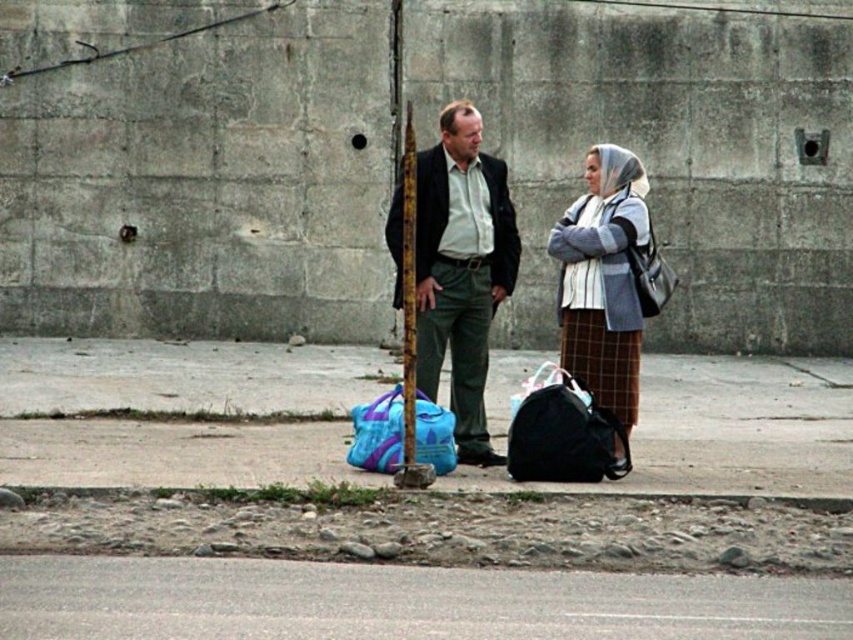
You are a photographer setting up a tripod to take a photo of the dark green fabric jacket at center and the matte blue duffel bag at center. Since you want to capture both items clearly in the frame, which object should you focus on first to ensure proper depth of field?

You should focus on the dark green fabric jacket at center first because it is closer to the viewer than the matte blue duffel bag at center, ensuring the depth of field captures both items clearly.

You are a delivery person who needs to place a large package between the smooth concrete curb at lower center and the brushed metal pole at center. Can you fit it there?

The smooth concrete curb at lower center might be wider than the brushed metal pole at center, so there might be enough space to fit the large package between them.

You are a photographer trying to capture a candid shot of the two people in the scene. You notice the dark green fabric jacket at center and the matte blue duffel bag at center. Which object is wider when viewed from your camera lens?

The dark green fabric jacket at center is wider than the matte blue duffel bag at center according to the description.